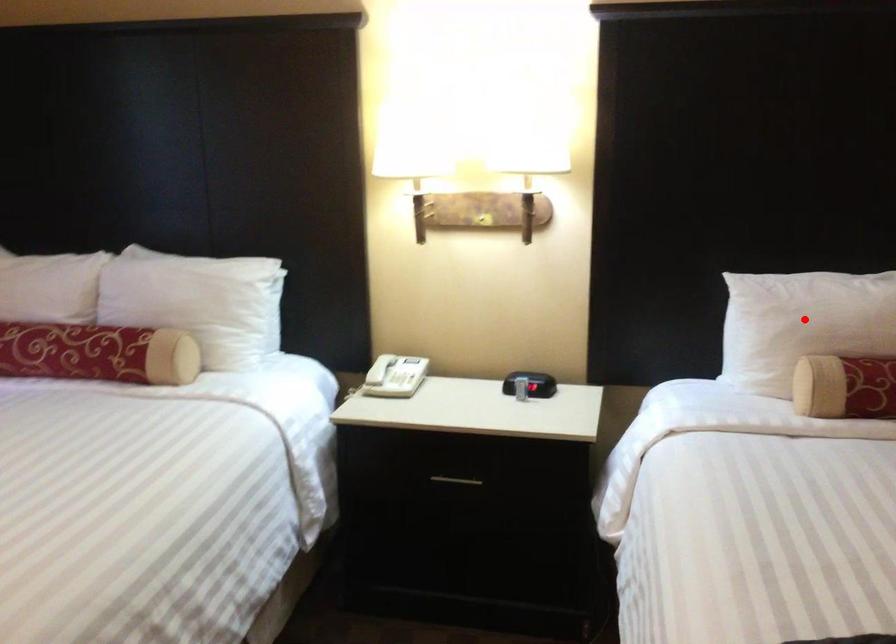
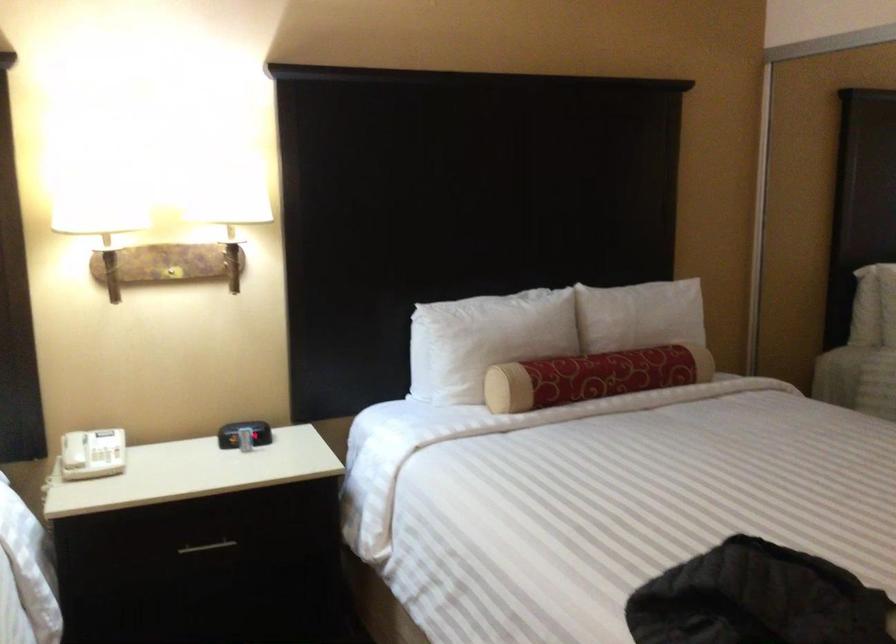
Question: I am providing you with two images of the same scene from different viewpoints. In image1, a red point is highlighted. Considering the same 3D point in image2, which of the following is correct?

Choices:
 (A) It is closer
 (B) It is farther

Answer: (B)